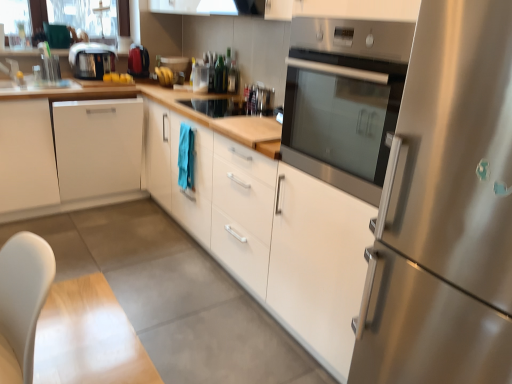
Question: Does stainless steel oven at center lie behind white matte cabinet at left, the 2th cabinetry when ordered from right to left?

Choices:
 (A) no
 (B) yes

Answer: (A)

Question: Does stainless steel oven at center appear on the right side of white matte cabinet at left, the 2th cabinetry when ordered from right to left?

Choices:
 (A) no
 (B) yes

Answer: (B)

Question: From a real-world perspective, is stainless steel oven at center physically above white matte cabinet at left, the 2th cabinetry when ordered from right to left?

Choices:
 (A) yes
 (B) no

Answer: (A)

Question: Is stainless steel oven at center positioned in front of white matte cabinet at left, acting as the first cabinetry starting from the left?

Choices:
 (A) yes
 (B) no

Answer: (A)

Question: Are stainless steel oven at center and white matte cabinet at left, acting as the first cabinetry starting from the left, beside each other?

Choices:
 (A) no
 (B) yes

Answer: (A)

Question: From the image's perspective, is satin black toaster at upper left positioned above or below white matte cabinet at center, arranged as the first cabinetry when viewed from the right?

Choices:
 (A) above
 (B) below

Answer: (A)

Question: Considering the relative positions of satin black toaster at upper left and white matte cabinet at center, placed as the second cabinetry when sorted from left to right, in the image provided, is satin black toaster at upper left to the left or to the right of white matte cabinet at center, placed as the second cabinetry when sorted from left to right,?

Choices:
 (A) left
 (B) right

Answer: (A)

Question: Is satin black toaster at upper left in front of or behind white matte cabinet at center, arranged as the first cabinetry when viewed from the right, in the image?

Choices:
 (A) behind
 (B) front

Answer: (A)

Question: From their relative heights in the image, would you say satin black toaster at upper left is taller or shorter than white matte cabinet at center, placed as the second cabinetry when sorted from left to right?

Choices:
 (A) short
 (B) tall

Answer: (A)

Question: In terms of size, does stainless steel oven at center appear bigger or smaller than white matte cabinet at center, arranged as the first cabinetry when viewed from the right?

Choices:
 (A) big
 (B) small

Answer: (B)

Question: Is point (302, 150) positioned closer to the camera than point (273, 286)?

Choices:
 (A) farther
 (B) closer

Answer: (B)

Question: Looking at their shapes, would you say stainless steel oven at center is wider or thinner than white matte cabinet at center, arranged as the first cabinetry when viewed from the right?

Choices:
 (A) wide
 (B) thin

Answer: (B)

Question: Which is correct: stainless steel oven at center is inside white matte cabinet at center, arranged as the first cabinetry when viewed from the right, or outside of it?

Choices:
 (A) inside
 (B) outside

Answer: (B)

Question: From a real-world perspective, relative to clear glass jar at center, placed as the second appliance when sorted from left to right, is satin black toaster at upper left vertically above or below?

Choices:
 (A) above
 (B) below

Answer: (A)

Question: Relative to clear glass jar at center, placed as the 1th appliance when sorted from right to left, is satin black toaster at upper left in front or behind?

Choices:
 (A) behind
 (B) front

Answer: (B)